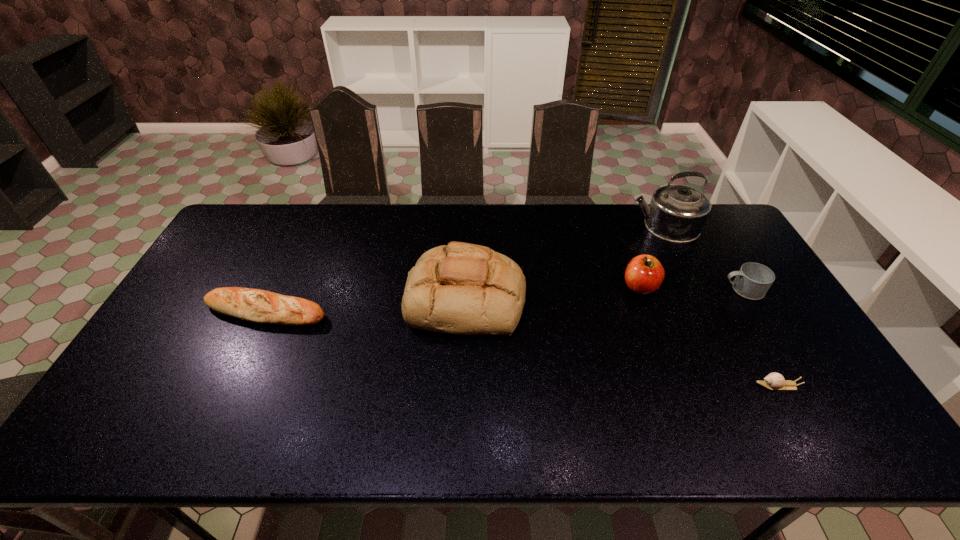
This screenshot has height=540, width=960. I want to click on empty space between the mug and the second object from left to right, so point(605,294).

Where is `object that is the closest to the kettle`? The height and width of the screenshot is (540, 960). object that is the closest to the kettle is located at coordinates (644, 274).

At what (x,y) coordinates should I click in order to perform the action: click on object that is the third closest to the nearest object. Please return your answer as a coordinate pair (x, y). This screenshot has width=960, height=540. Looking at the image, I should click on (677, 213).

This screenshot has width=960, height=540. What are the coordinates of `free space that satisfies the following two spatial constraints: 1. with the spout at the front of the farthest object; 2. on the front side of the third tallest object` in the screenshot? It's located at (694, 287).